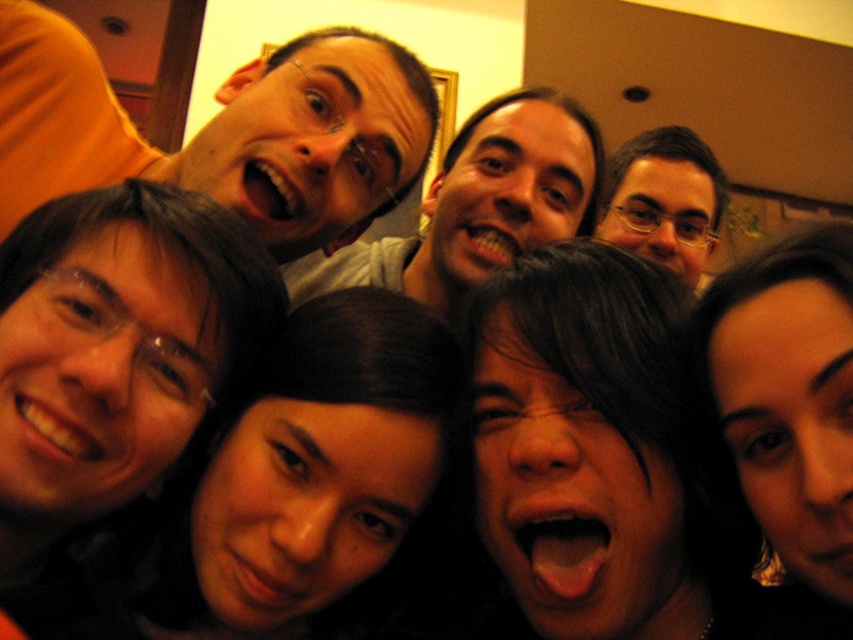
Question: Which point is closer to the camera?

Choices:
 (A) (347, 33)
 (B) (700, 180)
 (C) (560, 177)

Answer: (A)

Question: Which of the following is the farthest from the observer?

Choices:
 (A) (492, 195)
 (B) (326, 173)

Answer: (A)

Question: In this image, where is matte black hair at upper left located relative to matte gray shirt at center?

Choices:
 (A) above
 (B) below

Answer: (A)

Question: Among these objects, which one is farthest from the camera?

Choices:
 (A) matte black glasses at upper center
 (B) matte black hair at upper left
 (C) matte gray shirt at center

Answer: (A)

Question: Can you confirm if matte gray shirt at center is wider than matte black glasses at upper center?

Choices:
 (A) yes
 (B) no

Answer: (A)

Question: Is matte gray shirt at center wider than matte black glasses at upper center?

Choices:
 (A) yes
 (B) no

Answer: (A)